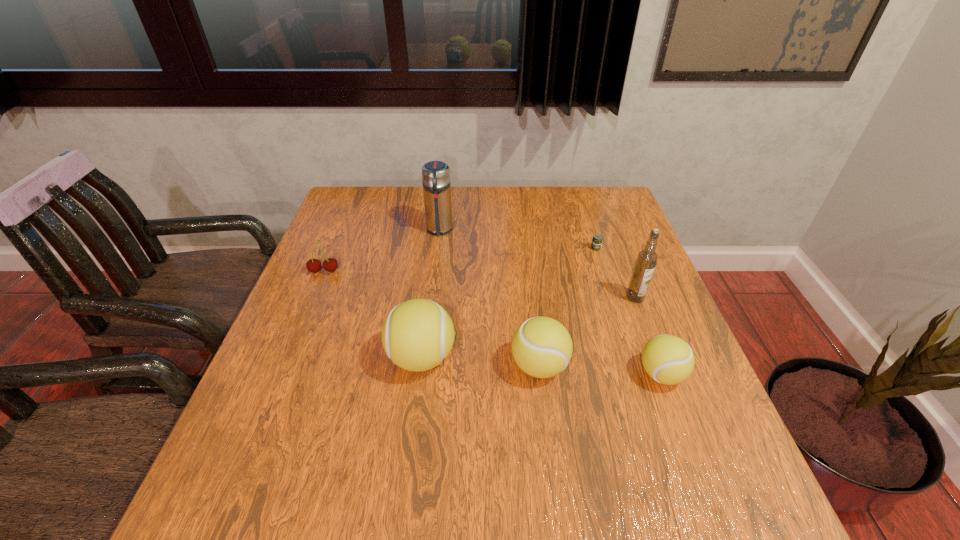
The width and height of the screenshot is (960, 540). I want to click on vacant spot to place a tennis ball on the left, so coord(308,350).